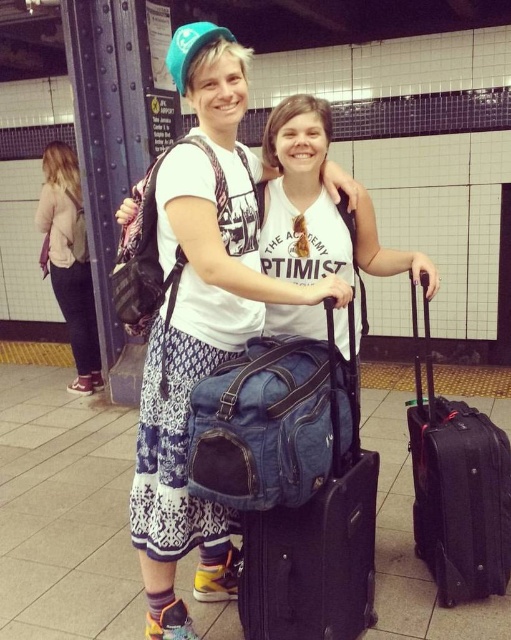
Question: Can you confirm if white cotton shirt at center is positioned above light pink sweater at left?

Choices:
 (A) no
 (B) yes

Answer: (A)

Question: From the image, what is the correct spatial relationship of denim fabric suitcase at center in relation to light pink sweater at left?

Choices:
 (A) right
 (B) left

Answer: (A)

Question: Which object appears farthest from the camera in this image?

Choices:
 (A) white cotton shirt at center
 (B) light pink sweater at left
 (C) denim fabric suitcase at center

Answer: (B)

Question: Based on their relative distances, which object is farther from the white cotton shirt at center?

Choices:
 (A) denim fabric suitcase at center
 (B) light pink sweater at left
 (C) black hardshell suitcase at right

Answer: (B)

Question: Which point is closer to the camera?

Choices:
 (A) denim fabric suitcase at center
 (B) light pink sweater at left
 (C) black hardshell suitcase at right
 (D) white cotton shirt at center

Answer: (A)

Question: Does black hardshell suitcase at right appear on the left side of light pink sweater at left?

Choices:
 (A) no
 (B) yes

Answer: (A)